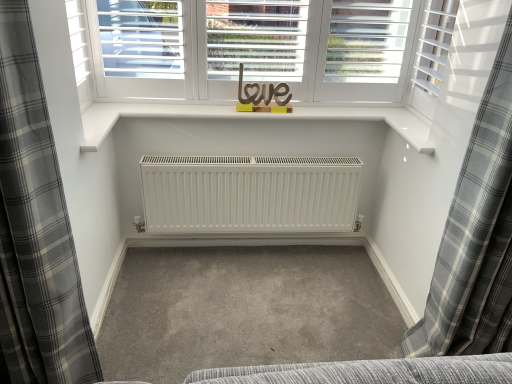
Question: Is gray plaid curtain at left, positioned as the 2th curtain in right-to-left order, to the left of gray plaid curtain at right, placed as the second curtain when sorted from left to right, from the viewer's perspective?

Choices:
 (A) no
 (B) yes

Answer: (B)

Question: From a real-world perspective, is gray plaid curtain at left, positioned as the 2th curtain in right-to-left order, located higher than gray plaid curtain at right, which ranks as the first curtain in right-to-left order?

Choices:
 (A) yes
 (B) no

Answer: (B)

Question: Could gray plaid curtain at right, placed as the second curtain when sorted from left to right, be considered to be inside gray plaid curtain at left, acting as the first curtain starting from the left?

Choices:
 (A) yes
 (B) no

Answer: (B)

Question: From a real-world perspective, is gray plaid curtain at left, positioned as the 2th curtain in right-to-left order, below gray plaid curtain at right, placed as the second curtain when sorted from left to right?

Choices:
 (A) no
 (B) yes

Answer: (B)

Question: Is gray plaid curtain at left, acting as the first curtain starting from the left, thinner than gray plaid curtain at right, placed as the second curtain when sorted from left to right?

Choices:
 (A) no
 (B) yes

Answer: (A)

Question: Is gray plaid curtain at left, positioned as the 2th curtain in right-to-left order, outside of gray plaid curtain at right, which ranks as the first curtain in right-to-left order?

Choices:
 (A) no
 (B) yes

Answer: (B)

Question: Can you confirm if white matte shutter at upper right is positioned to the left of gray plaid curtain at right, which ranks as the first curtain in right-to-left order?

Choices:
 (A) yes
 (B) no

Answer: (A)

Question: Could you tell me if white matte shutter at upper right is facing gray plaid curtain at right, placed as the second curtain when sorted from left to right?

Choices:
 (A) yes
 (B) no

Answer: (B)

Question: Is white matte shutter at upper right in contact with gray plaid curtain at right, which ranks as the first curtain in right-to-left order?

Choices:
 (A) no
 (B) yes

Answer: (A)

Question: Is white matte shutter at upper right turned away from gray plaid curtain at right, placed as the second curtain when sorted from left to right?

Choices:
 (A) no
 (B) yes

Answer: (A)

Question: Would you say gray plaid curtain at right, which ranks as the first curtain in right-to-left order, is part of white matte shutter at upper right's contents?

Choices:
 (A) yes
 (B) no

Answer: (B)

Question: Is white matte shutter at upper right further to the viewer compared to gray plaid curtain at right, placed as the second curtain when sorted from left to right?

Choices:
 (A) yes
 (B) no

Answer: (A)

Question: Considering the relative sizes of white matte shutter at upper right and gray plaid curtain at left, positioned as the 2th curtain in right-to-left order, in the image provided, is white matte shutter at upper right bigger than gray plaid curtain at left, positioned as the 2th curtain in right-to-left order,?

Choices:
 (A) yes
 (B) no

Answer: (B)